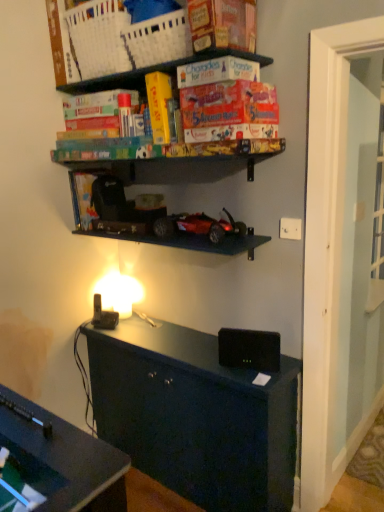
Question: Can you confirm if white plastic basket at upper center is smaller than white plastic electric outlet at upper right?

Choices:
 (A) no
 (B) yes

Answer: (A)

Question: From a real-world perspective, is white plastic basket at upper center located beneath white plastic electric outlet at upper right?

Choices:
 (A) no
 (B) yes

Answer: (A)

Question: Is white plastic basket at upper center at the left side of white plastic electric outlet at upper right?

Choices:
 (A) no
 (B) yes

Answer: (B)

Question: Could you tell me if white plastic basket at upper center is turned towards white plastic electric outlet at upper right?

Choices:
 (A) yes
 (B) no

Answer: (B)

Question: Can you confirm if white plastic basket at upper center is wider than white plastic electric outlet at upper right?

Choices:
 (A) no
 (B) yes

Answer: (B)

Question: Is white plastic basket at upper center directly adjacent to white plastic electric outlet at upper right?

Choices:
 (A) yes
 (B) no

Answer: (B)

Question: From the image's perspective, is black matte speaker at center over white plastic electric outlet at upper right?

Choices:
 (A) yes
 (B) no

Answer: (B)

Question: From a real-world perspective, is black matte speaker at center on top of white plastic electric outlet at upper right?

Choices:
 (A) no
 (B) yes

Answer: (A)

Question: Can you confirm if black matte speaker at center is positioned to the right of white plastic electric outlet at upper right?

Choices:
 (A) yes
 (B) no

Answer: (B)

Question: Does black matte speaker at center have a larger size compared to white plastic electric outlet at upper right?

Choices:
 (A) yes
 (B) no

Answer: (A)

Question: Does black matte speaker at center have a lesser height compared to white plastic electric outlet at upper right?

Choices:
 (A) yes
 (B) no

Answer: (B)

Question: Considering the relative positions of black matte speaker at center and white plastic electric outlet at upper right in the image provided, is black matte speaker at center in front of white plastic electric outlet at upper right?

Choices:
 (A) no
 (B) yes

Answer: (B)

Question: Is orange matte board game at upper center shorter than shiny red plastic toy car at center?

Choices:
 (A) no
 (B) yes

Answer: (A)